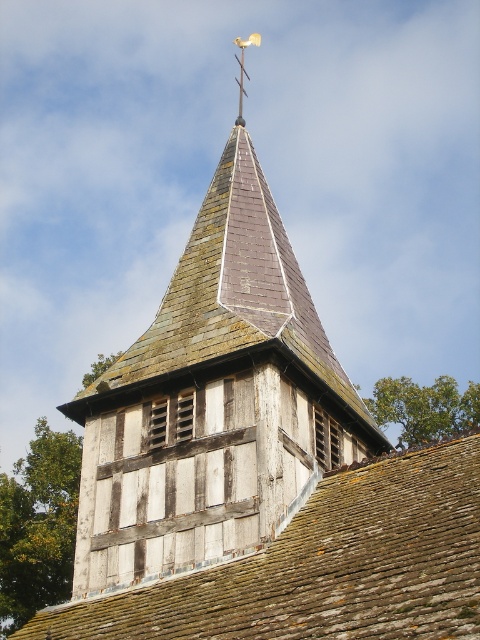
You are an architect assessing the structural integrity of the building. You notice the weathered wood steeple at center and the weathered brown shingles at center. Which of these two elements has a narrower width?

The weathered wood steeple at center is thinner than weathered brown shingles at center, so the weathered wood steeple at center has a narrower width.

You are an architect inspecting the roof of a historic building. You notice the weathered brown shingles at center and the metallic weather vane at upper center. Which object takes up more area on the roof?

The metallic weather vane at upper center occupies more space than the weathered brown shingles at center.